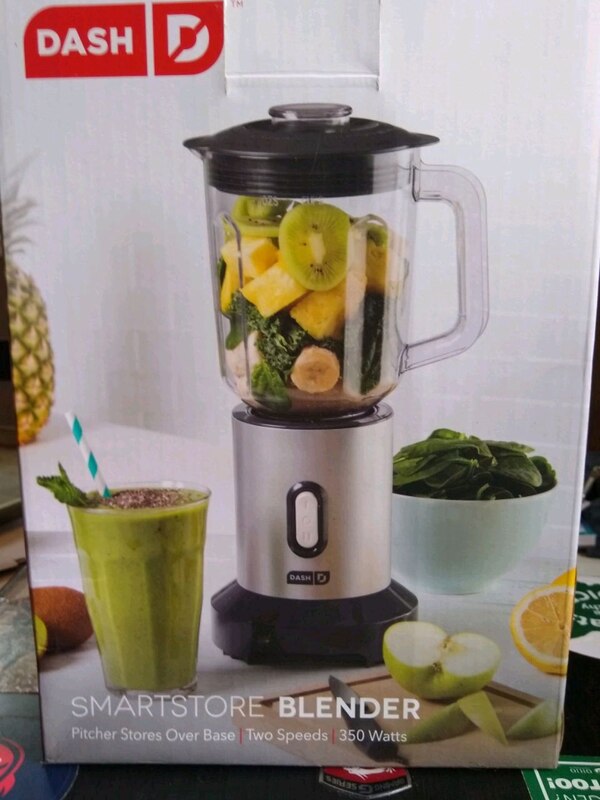
Locate an element on the screen. This screenshot has width=600, height=800. bowl is located at coordinates (507, 557).